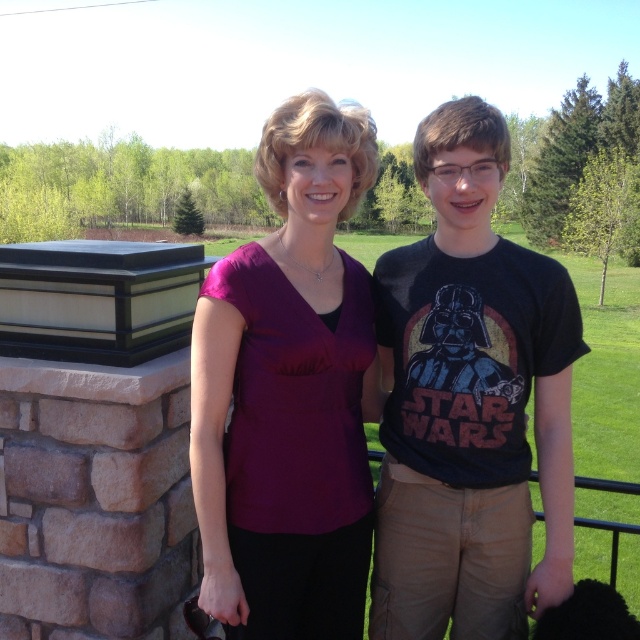
Question: Is dark gray t-shirt at center to the left of matte purple blouse at center from the viewer's perspective?

Choices:
 (A) no
 (B) yes

Answer: (A)

Question: Which point is farther to the camera?

Choices:
 (A) dark gray t-shirt at center
 (B) matte purple blouse at center

Answer: (A)

Question: Does dark gray t-shirt at center come behind matte purple blouse at center?

Choices:
 (A) no
 (B) yes

Answer: (B)

Question: Can you confirm if dark gray t-shirt at center is positioned to the left of matte purple blouse at center?

Choices:
 (A) no
 (B) yes

Answer: (A)

Question: Which point appears farthest from the camera in this image?

Choices:
 (A) (468, 438)
 (B) (321, 577)

Answer: (B)